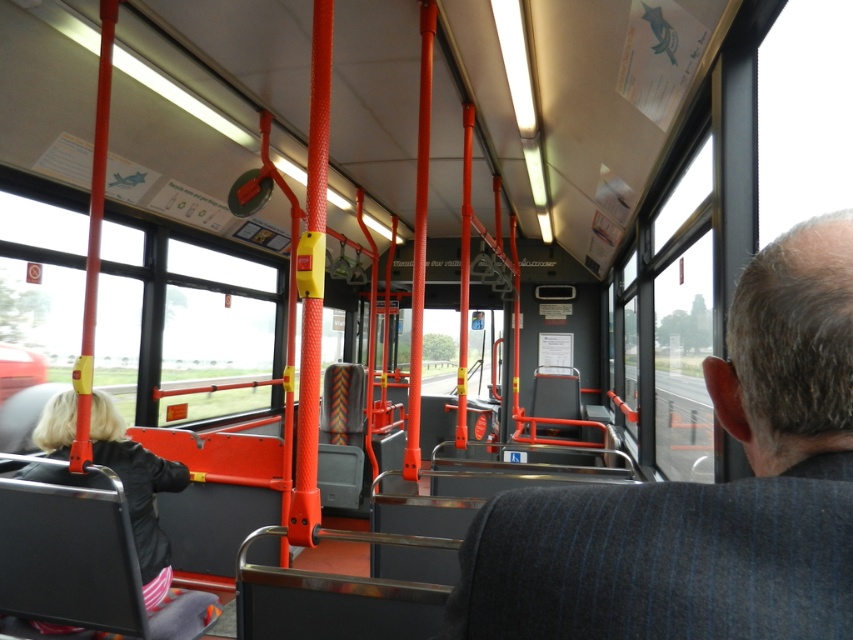
Does transparent glass window at center have a lesser width compared to black fabric jacket at lower left?

Indeed, transparent glass window at center has a lesser width compared to black fabric jacket at lower left.

Is point (247, 380) farther from camera compared to point (117, 445)?

Yes.

Identify the location of transparent glass window at center. The height and width of the screenshot is (640, 853). (215, 320).

Can you confirm if matte black coach at center is wider than transparent glass window at center?

Incorrect, matte black coach at center's width does not surpass transparent glass window at center's.

Can you confirm if matte black coach at center is positioned to the left of transparent glass window at center?

In fact, matte black coach at center is to the right of transparent glass window at center.

This screenshot has width=853, height=640. In order to click on matte black coach at center in this screenshot , I will do `click(703, 492)`.

Find the location of a particular element. The image size is (853, 640). matte black coach at center is located at coordinates (703, 492).

From the picture: Is matte black coach at center to the right of black fabric jacket at lower left from the viewer's perspective?

Indeed, matte black coach at center is positioned on the right side of black fabric jacket at lower left.

Who is taller, matte black coach at center or black fabric jacket at lower left?

black fabric jacket at lower left

Is point (502, 493) less distant than point (142, 483)?

Yes, it is in front of point (142, 483).

This screenshot has height=640, width=853. Find the location of `matte black coach at center`. matte black coach at center is located at coordinates (703, 492).